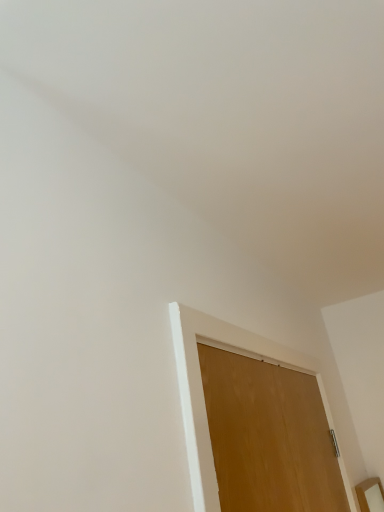
Question: Should I look upward or downward to see wooden door at center?

Choices:
 (A) up
 (B) down

Answer: (B)